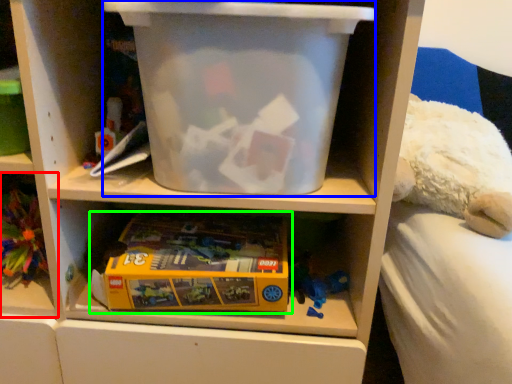
Question: Considering the real-world distances, which object is closest to shelf (highlighted by a red box)? storage box (highlighted by a blue box) or toy (highlighted by a green box).

Choices:
 (A) storage box
 (B) toy

Answer: (B)